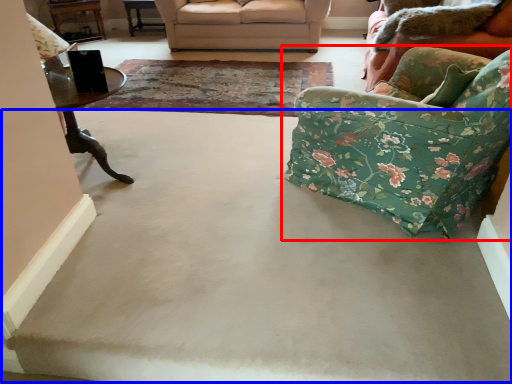
Question: Which object is further to the camera taking this photo, chair (highlighted by a red box) or concrete (highlighted by a blue box)?

Choices:
 (A) chair
 (B) concrete

Answer: (B)